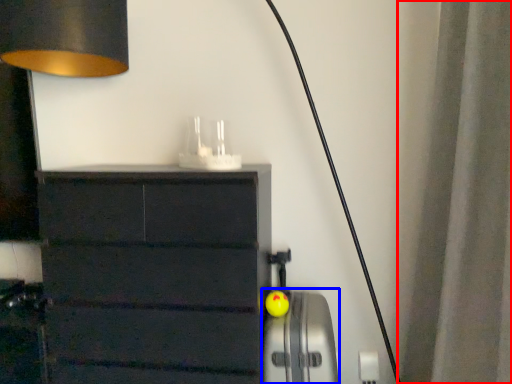
Question: Among these objects, which one is farthest to the camera, curtain (highlighted by a red box) or appliance (highlighted by a blue box)?

Choices:
 (A) curtain
 (B) appliance

Answer: (B)